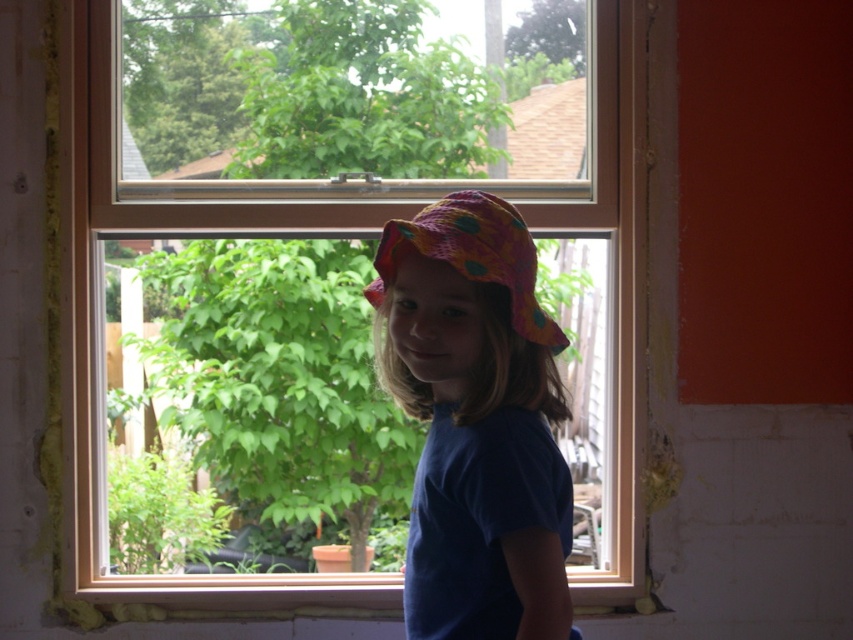
You are a window cleaner who needs to clean the clear glass window at center and the polka dot fabric hat at center. Which object requires a taller ladder to reach its top?

The clear glass window at center is much taller than the polka dot fabric hat at center, so you will need a taller ladder to reach the top of the clear glass window at center.

You are a photographer trying to capture the garden view through the window. You notice the matte pink fabric hat at center and the clear glass window at center. Which object is closer to the camera, and why?

The clear glass window at center is closer to the camera because the matte pink fabric hat at center is behind it, meaning the hat is farther away.

You are a painter standing in the room where the child is. You want to paint the view through the window. You have two spots marked at coordinates point (631, 113) and point (508, 227). Which point is closer to you so you can focus your painting there?

Point (631, 113) is further to the viewer than point (508, 227), so the closer point to focus on would be point (508, 227).